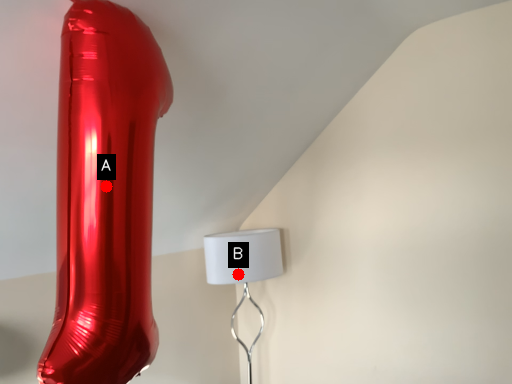
Question: Two points are circled on the image, labeled by A and B beside each circle. Which of the following is the closest to the observer?

Choices:
 (A) A is closer
 (B) B is closer

Answer: (A)